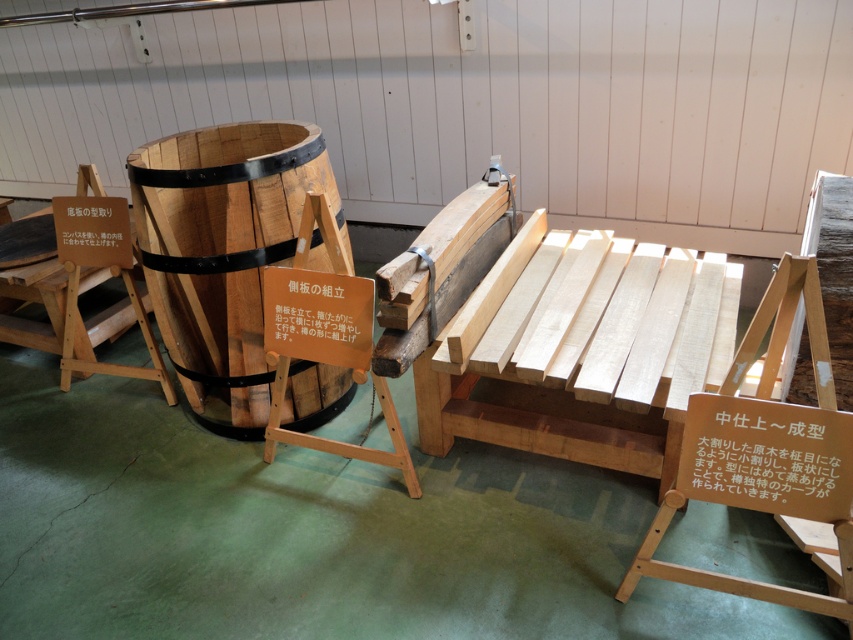
Question: In this image, where is light brown wood chair at center located relative to natural wood chair at center?

Choices:
 (A) right
 (B) left

Answer: (A)

Question: From the image, what is the correct spatial relationship of light brown wood chair at center in relation to natural wood chair at center?

Choices:
 (A) below
 (B) above

Answer: (A)

Question: Which of the following is the farthest from the observer?

Choices:
 (A) natural wood chair at center
 (B) natural wood barrel at center

Answer: (A)

Question: Does natural wood barrel at center appear under light brown wood chair at center?

Choices:
 (A) no
 (B) yes

Answer: (A)

Question: Which point is closer to the camera taking this photo?

Choices:
 (A) (86, 204)
 (B) (154, 148)

Answer: (A)

Question: Which of these objects is positioned closest to the natural wood chair at center?

Choices:
 (A) light brown wood chair at center
 (B) natural wood barrel at center

Answer: (B)